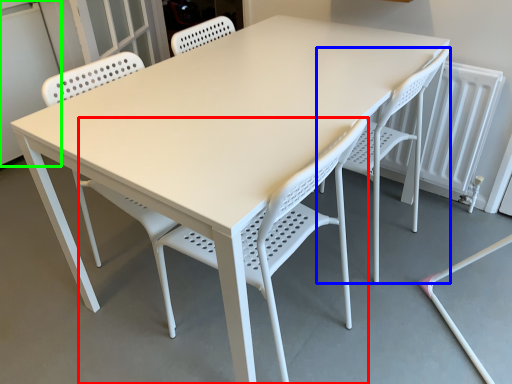
Question: Which is nearer to the chair (highlighted by a red box)? chair (highlighted by a blue box) or screen door (highlighted by a green box).

Choices:
 (A) chair
 (B) screen door

Answer: (A)